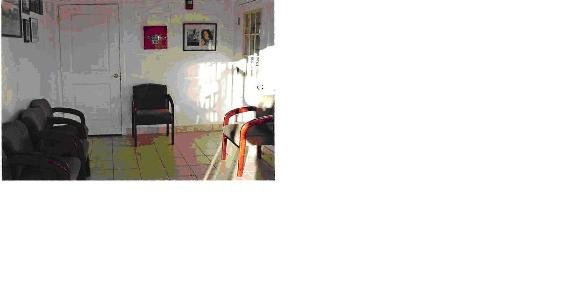
Image resolution: width=576 pixels, height=294 pixels. In order to click on photos on left wall in this screenshot , I will do `click(32, 32)`, `click(34, 9)`, `click(25, 3)`, `click(22, 29)`, `click(15, 24)`.